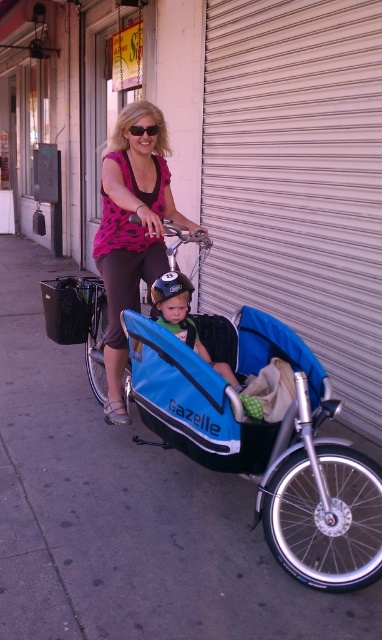
Where is the matte pink shirt at center positioned in the image?

The matte pink shirt at center is positioned at coordinates point (132, 230).

You are a pedestrian standing on the sidewalk and see the woman riding her bicycle with the matte blue helmet at center and the black plastic sunglasses at upper center. Which object is positioned more to the right from your perspective?

The matte blue helmet at center is positioned more to the right than the black plastic sunglasses at upper center.

You are a photographer trying to capture a clear shot of the matte pink shirt at center and the matte blue helmet at center. Which object should you zoom in on to ensure both are in focus without changing your position?

The matte pink shirt at center is larger in size than the matte blue helmet at center, so you should zoom in on the matte pink shirt at center to ensure both are in focus without changing your position.